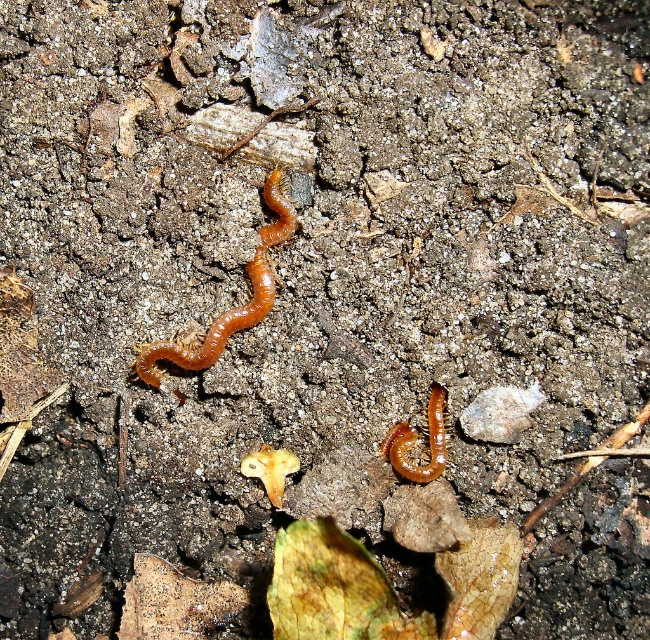
Question: Can you confirm if shiny orange centipede at center is positioned below orange rubbery centipede at lower center?

Choices:
 (A) no
 (B) yes

Answer: (A)

Question: Is shiny orange centipede at center further to the viewer compared to orange rubbery centipede at lower center?

Choices:
 (A) yes
 (B) no

Answer: (B)

Question: Which point appears closest to the camera in this image?

Choices:
 (A) (188, 348)
 (B) (430, 422)

Answer: (A)

Question: Is shiny orange centipede at center wider than orange rubbery centipede at lower center?

Choices:
 (A) yes
 (B) no

Answer: (A)